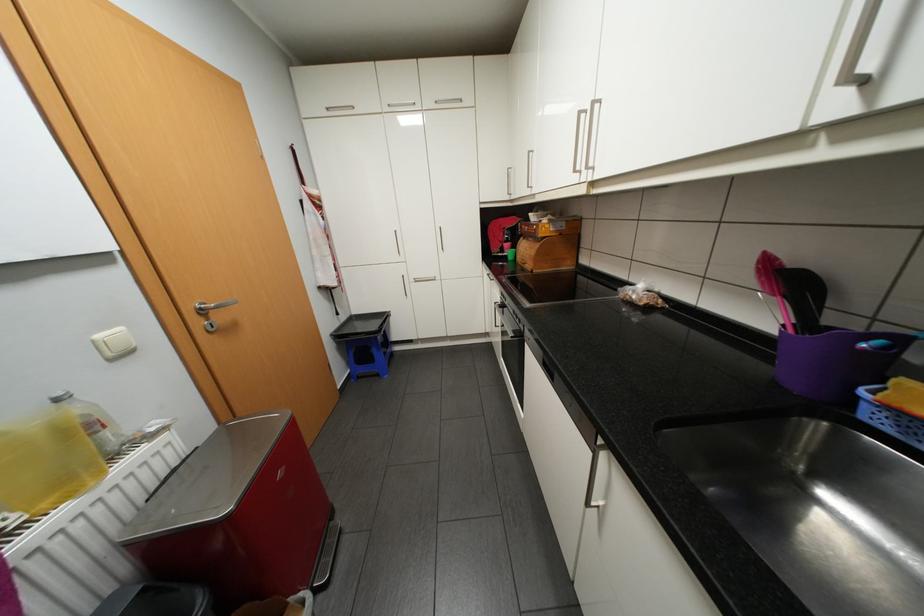
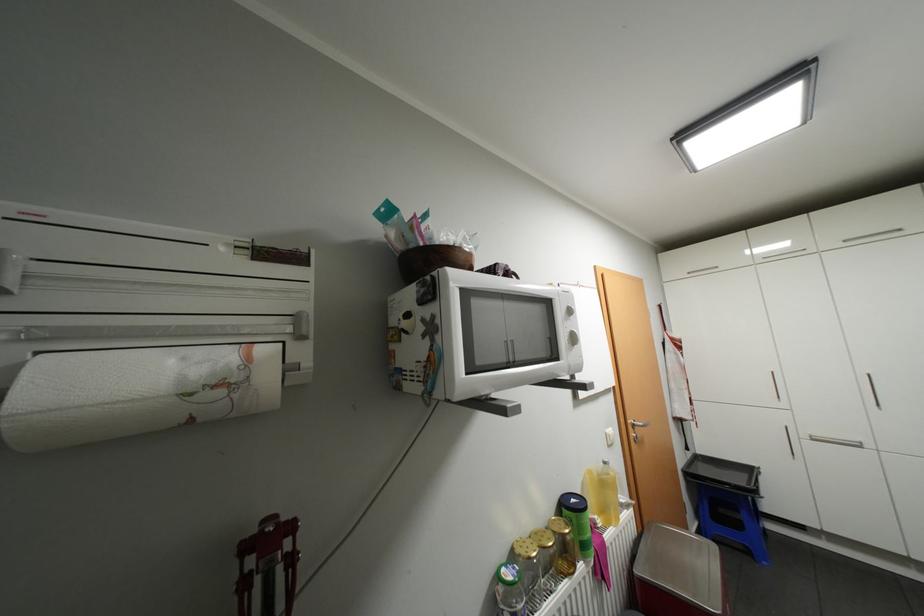
Question: I am providing you with two images of the same scene from different viewpoints. Which of the following objects are not visible in image2?

Choices:
 (A) silver door handle
 (B) green lidded canister
 (C) glass jar with lid
 (D) none of these

Answer: (D)